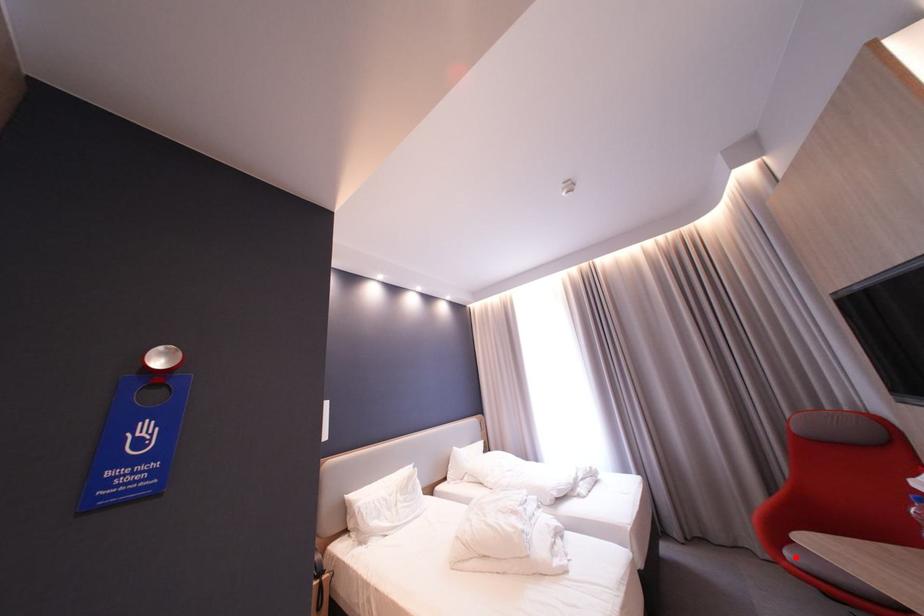
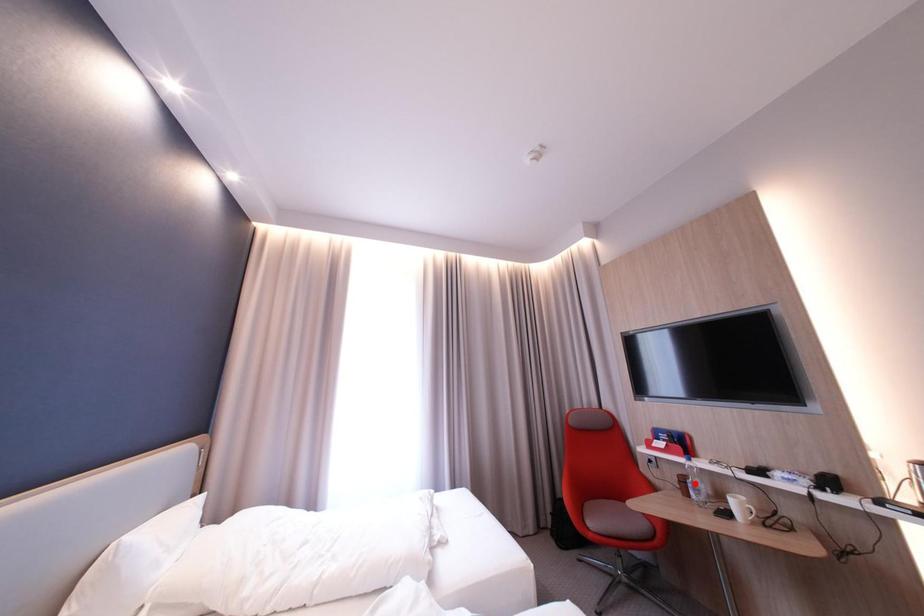
I am providing you with two images of the same scene from different viewpoints. A red point is marked on the first image and another point is marked on the second image. Do the highlighted points in image1 and image2 indicate the same real-world spot?

No